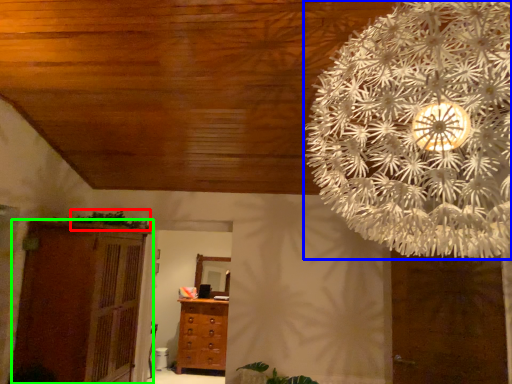
Question: Which object is positioned closest to plant (highlighted by a red box)? Select from flower (highlighted by a blue box) and cupboard (highlighted by a green box).

Choices:
 (A) flower
 (B) cupboard

Answer: (B)